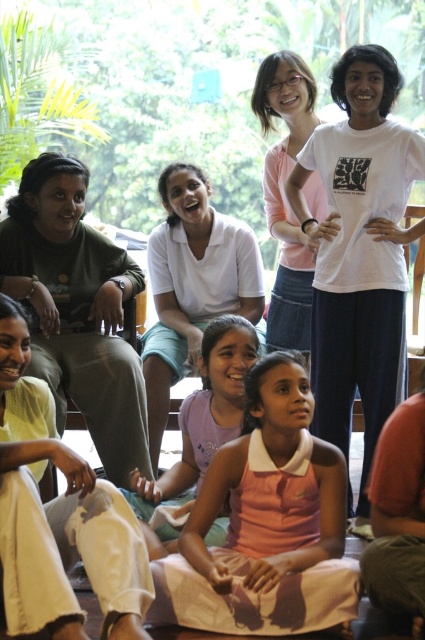
You are a photographer standing in front of the group. You need to take a photo that includes both the matte green shirt at left and the white cotton shirt at center. Which shirt should you adjust to ensure both are visible in the frame?

The matte green shirt at left is located below the white cotton shirt at center. To ensure both are visible, you should adjust the white cotton shirt at center to move upwards or the matte green shirt at left to move downwards.

You are a photographer standing at the entrance of the room. You want to take a photo of the white cotton shirt at center. Where should you aim your camera to capture it?

You should aim your camera at point 0.452 on the vertical axis and 0.447 on the horizontal axis to capture the white cotton shirt at center.